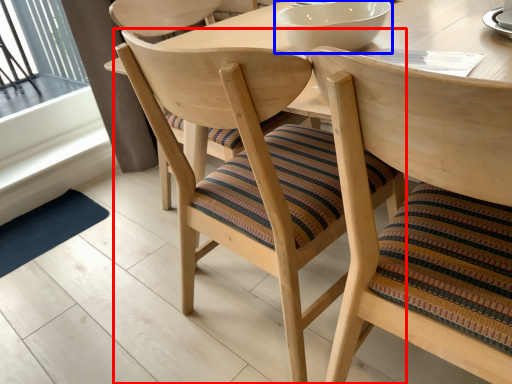
Question: Which point is further to the camera, chair (highlighted by a red box) or bowl (highlighted by a blue box)?

Choices:
 (A) chair
 (B) bowl

Answer: (B)